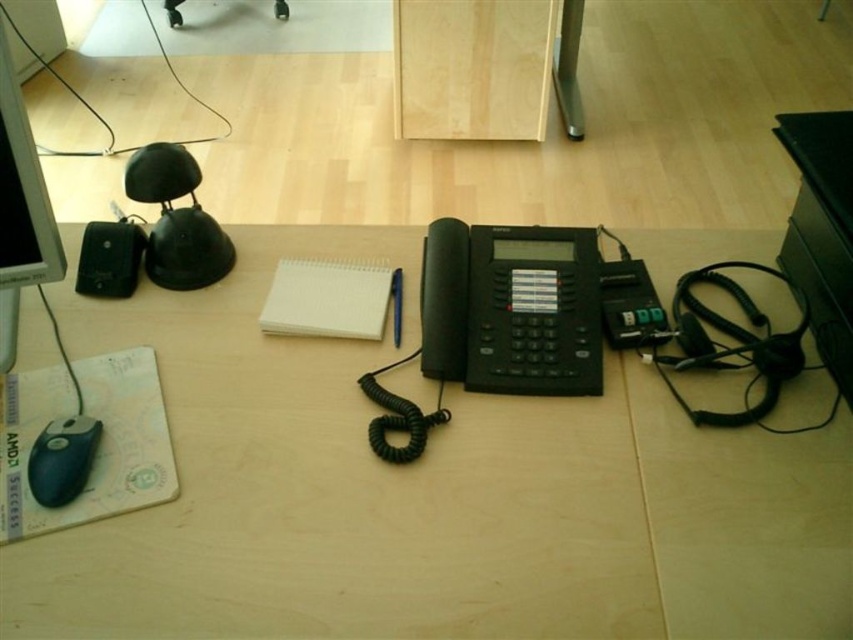
Between black rubberized lamp at left and white paper notepad at center, which one is positioned higher?

black rubberized lamp at left is above.

Identify the location of black rubberized lamp at left. (177, 220).

What do you see at coordinates (177, 220) in the screenshot? This screenshot has width=853, height=640. I see `black rubberized lamp at left` at bounding box center [177, 220].

Identify the location of black rubberized lamp at left. click(177, 220).

Is matte black telephone at center thinner than matte black monitor at left?

No, matte black telephone at center is not thinner than matte black monitor at left.

Does matte black telephone at center appear on the right side of matte black monitor at left?

Indeed, matte black telephone at center is positioned on the right side of matte black monitor at left.

The height and width of the screenshot is (640, 853). Describe the element at coordinates (428, 496) in the screenshot. I see `matte black telephone at center` at that location.

You are a GUI agent. You are given a task and a screenshot of the screen. Output one action in this format:
    pyautogui.click(x=<x>, y=<y>)
    Task: Click on the matte black telephone at center
    
    Given the screenshot: What is the action you would take?
    pyautogui.click(x=428, y=496)

Who is more distant from viewer, (399, 544) or (68, 472)?

Point (68, 472)

Does matte black telephone at center have a lesser height compared to black rubber mouse at lower left?

Incorrect, matte black telephone at center's height does not fall short of black rubber mouse at lower left's.

Is point (262, 496) positioned before point (71, 486)?

No, it is not.

The height and width of the screenshot is (640, 853). I want to click on matte black telephone at center, so click(x=428, y=496).